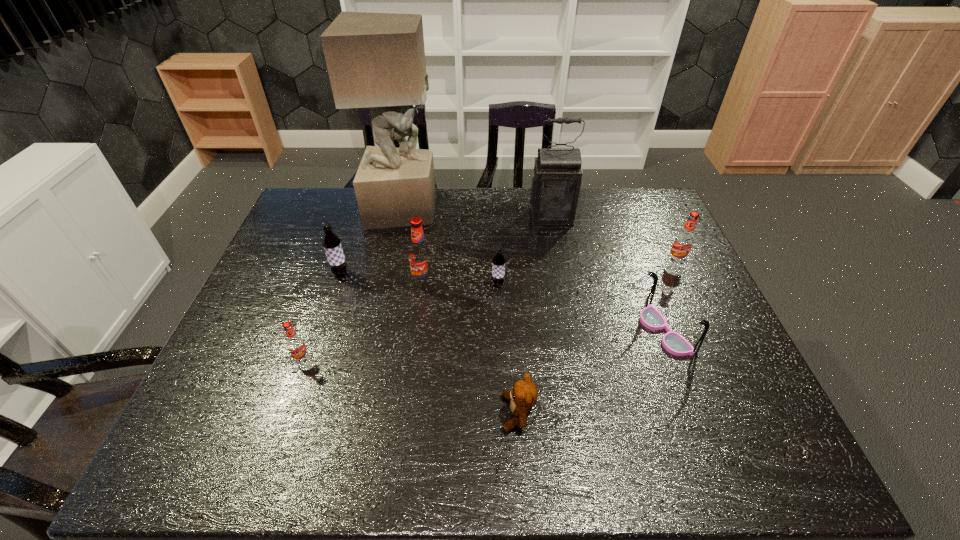
Locate which root beer is the second closest to the rightmost red root beer. Please provide its 2D coordinates. Your answer should be formatted as a tuple, i.e. [(x, y)], where the tuple contains the x and y coordinates of a point satisfying the conditions above.

[(420, 258)]

Point out which red root beer is positioned as the second nearest to the third root beer from right to left. Please provide its 2D coordinates. Your answer should be formatted as a tuple, i.e. [(x, y)], where the tuple contains the x and y coordinates of a point satisfying the conditions above.

[(683, 242)]

Identify which red root beer is the third closest to the right brown root beer. Please provide its 2D coordinates. Your answer should be formatted as a tuple, i.e. [(x, y)], where the tuple contains the x and y coordinates of a point satisfying the conditions above.

[(295, 343)]

Locate an element on the screen. free space that satisfies the following two spatial constraints: 1. on the front side of the right brown root beer; 2. on the left side of the eighth object from left to right is located at coordinates (500, 332).